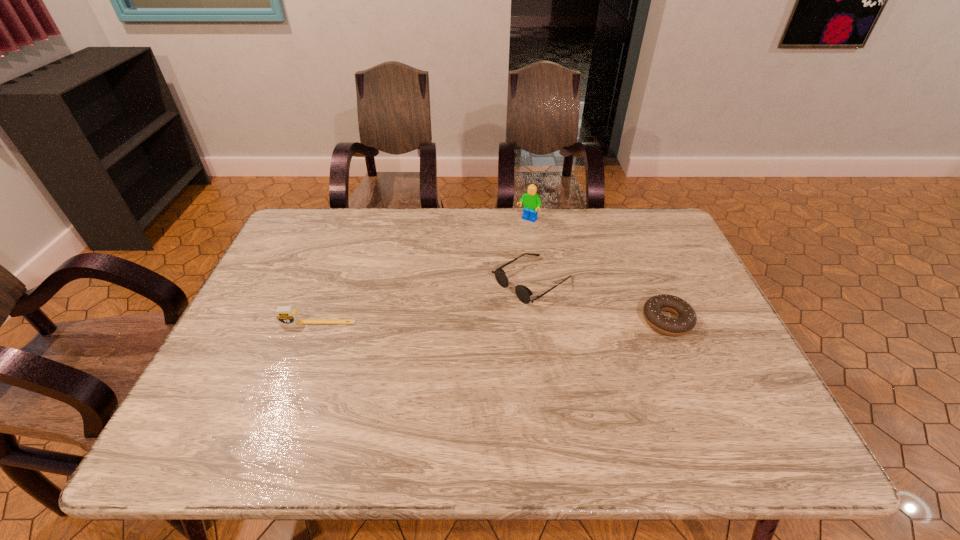
Where is `the leftmost object`? Image resolution: width=960 pixels, height=540 pixels. the leftmost object is located at coordinates (286, 315).

Identify the location of doughnut. (686, 319).

I want to click on sunglasses, so click(523, 293).

Find the location of a particular element. This screenshot has height=540, width=960. Lego is located at coordinates (531, 201).

The height and width of the screenshot is (540, 960). What are the coordinates of `the tallest object` in the screenshot? It's located at (531, 201).

At what (x,y) coordinates should I click in order to perform the action: click on vacant space located at the front of the leftmost object with the tape extended. Please return your answer as a coordinate pair (x, y). This screenshot has height=540, width=960. Looking at the image, I should click on (296, 383).

You are a GUI agent. You are given a task and a screenshot of the screen. Output one action in this format:
    pyautogui.click(x=<x>, y=<y>)
    Task: Click on the vacant space situated 0.400m on the back of the rightmost object
    The width and height of the screenshot is (960, 540).
    Given the screenshot: What is the action you would take?
    pyautogui.click(x=623, y=217)

This screenshot has height=540, width=960. Find the location of `free space located 0.350m on the front-facing side of the sunglasses`. free space located 0.350m on the front-facing side of the sunglasses is located at coordinates (388, 371).

What are the coordinates of `vacant space located 0.400m on the front-facing side of the sunglasses` in the screenshot? It's located at (368, 383).

What are the coordinates of `vacant position located 0.280m on the front-facing side of the sunglasses` in the screenshot? It's located at (414, 355).